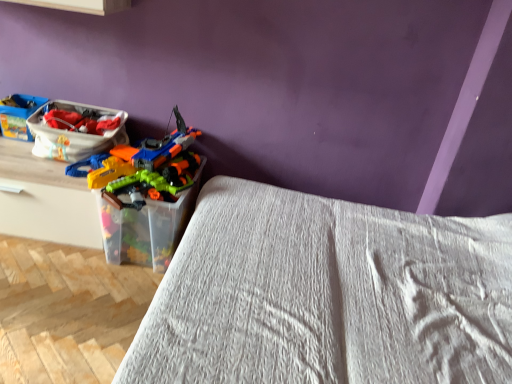
Question: Is translucent plastic container at center surrounded by white textured bed at center?

Choices:
 (A) yes
 (B) no

Answer: (B)

Question: Is white textured bed at center taller than translucent plastic container at center?

Choices:
 (A) no
 (B) yes

Answer: (B)

Question: Is white textured bed at center smaller than translucent plastic container at center?

Choices:
 (A) yes
 (B) no

Answer: (B)

Question: Are white textured bed at center and translucent plastic container at center far apart?

Choices:
 (A) no
 (B) yes

Answer: (A)

Question: Is the position of white textured bed at center more distant than that of translucent plastic container at center?

Choices:
 (A) yes
 (B) no

Answer: (B)

Question: Would you say matte plastic toy boat at left, marked as the first kit in a left-to-right arrangement, is to the left or to the right of white textured bed at center in the picture?

Choices:
 (A) left
 (B) right

Answer: (A)

Question: Looking at the image, does matte plastic toy boat at left, marked as the first kit in a left-to-right arrangement, seem bigger or smaller compared to white textured bed at center?

Choices:
 (A) small
 (B) big

Answer: (A)

Question: Is matte plastic toy boat at left, marked as the first kit in a left-to-right arrangement, wider or thinner than white textured bed at center?

Choices:
 (A) wide
 (B) thin

Answer: (B)

Question: From a real-world perspective, relative to white textured bed at center, is matte plastic toy boat at left, marked as the first kit in a left-to-right arrangement, vertically above or below?

Choices:
 (A) below
 (B) above

Answer: (B)

Question: Is translucent plastic container at center in front of or behind matte plastic toy boat at left, the second kit when ordered from right to left, in the image?

Choices:
 (A) front
 (B) behind

Answer: (A)

Question: Based on their sizes in the image, would you say translucent plastic container at center is bigger or smaller than matte plastic toy boat at left, marked as the first kit in a left-to-right arrangement?

Choices:
 (A) big
 (B) small

Answer: (A)

Question: From the image's perspective, is translucent plastic container at center above or below matte plastic toy boat at left, marked as the first kit in a left-to-right arrangement?

Choices:
 (A) below
 (B) above

Answer: (A)

Question: Is point (182, 193) positioned closer to the camera than point (13, 130)?

Choices:
 (A) farther
 (B) closer

Answer: (A)

Question: Is point (398, 347) positioned closer to the camera than point (172, 226)?

Choices:
 (A) closer
 (B) farther

Answer: (A)

Question: In the image, is white textured bed at center positioned in front of or behind translucent plastic container at center?

Choices:
 (A) front
 (B) behind

Answer: (A)